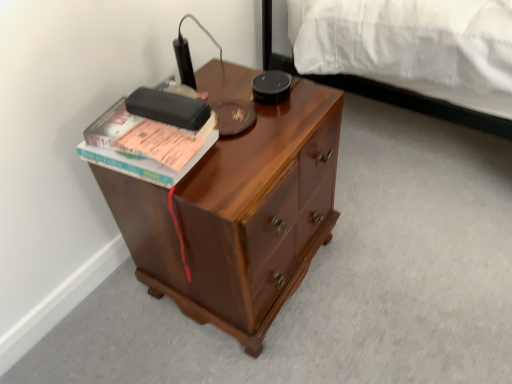
I want to click on hardcover book at upper left, so click(143, 146).

Measure the distance between point (158, 143) and camera.

Point (158, 143) and camera are 28.27 inches apart from each other.

This screenshot has height=384, width=512. Describe the element at coordinates (143, 146) in the screenshot. I see `hardcover book at upper left` at that location.

Locate an element on the screen. shiny brown wooden desk at center is located at coordinates (239, 216).

What do you see at coordinates (239, 216) in the screenshot? I see `shiny brown wooden desk at center` at bounding box center [239, 216].

Locate an element on the screen. hardcover book at upper left is located at coordinates (143, 146).

From the picture: Would you say hardcover book at upper left is to the left or to the right of shiny brown wooden desk at center in the picture?

Clearly, hardcover book at upper left is on the left of shiny brown wooden desk at center in the image.

Which object is closer to the camera, hardcover book at upper left or shiny brown wooden desk at center?

shiny brown wooden desk at center is more forward.

Which is closer, [165,186] or [311,224]?

Positioned in front is point [165,186].

From the image's perspective, is hardcover book at upper left located above or below shiny brown wooden desk at center?

hardcover book at upper left is above shiny brown wooden desk at center.

From a real-world perspective, is hardcover book at upper left below shiny brown wooden desk at center?

Actually, hardcover book at upper left is physically above shiny brown wooden desk at center in the real world.

Does hardcover book at upper left have a greater width compared to shiny brown wooden desk at center?

In fact, hardcover book at upper left might be narrower than shiny brown wooden desk at center.

Can you confirm if hardcover book at upper left is taller than shiny brown wooden desk at center?

No.

Considering the relative sizes of hardcover book at upper left and shiny brown wooden desk at center in the image provided, is hardcover book at upper left bigger than shiny brown wooden desk at center?

No, hardcover book at upper left is not bigger than shiny brown wooden desk at center.

Is hardcover book at upper left completely or partially outside of shiny brown wooden desk at center?

Yes, hardcover book at upper left is outside of shiny brown wooden desk at center.

Are hardcover book at upper left and shiny brown wooden desk at center located far from each other?

They are positioned close to each other.

Could you tell me if hardcover book at upper left is facing shiny brown wooden desk at center?

No, hardcover book at upper left is not facing towards shiny brown wooden desk at center.

How much distance is there between hardcover book at upper left and shiny brown wooden desk at center?

7.94 inches.

This screenshot has width=512, height=384. I want to click on desk located in front of the hardcover book at upper left, so click(239, 216).

Is shiny brown wooden desk at center at the left side of hardcover book at upper left?

No, shiny brown wooden desk at center is not to the left of hardcover book at upper left.

Considering their positions, is shiny brown wooden desk at center located in front of or behind hardcover book at upper left?

Clearly, shiny brown wooden desk at center is in front of hardcover book at upper left.

Considering the positions of point (208, 267) and point (154, 181), is point (208, 267) closer or farther from the camera than point (154, 181)?

Point (208, 267) is farther from the camera than point (154, 181).

From the image's perspective, which is below, shiny brown wooden desk at center or hardcover book at upper left?

From the image's view, shiny brown wooden desk at center is below.

From a real-world perspective, is shiny brown wooden desk at center positioned over hardcover book at upper left based on gravity?

No.

Which of these two, shiny brown wooden desk at center or hardcover book at upper left, is wider?

With larger width is shiny brown wooden desk at center.

Which of these two, shiny brown wooden desk at center or hardcover book at upper left, stands shorter?

Standing shorter between the two is hardcover book at upper left.

Is shiny brown wooden desk at center smaller than hardcover book at upper left?

Incorrect, shiny brown wooden desk at center is not smaller in size than hardcover book at upper left.

Would you say shiny brown wooden desk at center is inside or outside hardcover book at upper left?

shiny brown wooden desk at center is not enclosed by hardcover book at upper left.

Would you consider shiny brown wooden desk at center to be distant from hardcover book at upper left?

shiny brown wooden desk at center is near hardcover book at upper left, not far away.

Is shiny brown wooden desk at center facing towards hardcover book at upper left?

No.

In order to click on desk that is below the hardcover book at upper left (from the image's perspective) in this screenshot , I will do `click(239, 216)`.

Identify the location of paperback book located behind the shiny brown wooden desk at center. This screenshot has width=512, height=384. (143, 146).

This screenshot has height=384, width=512. I want to click on desk below the hardcover book at upper left (from a real-world perspective), so click(239, 216).